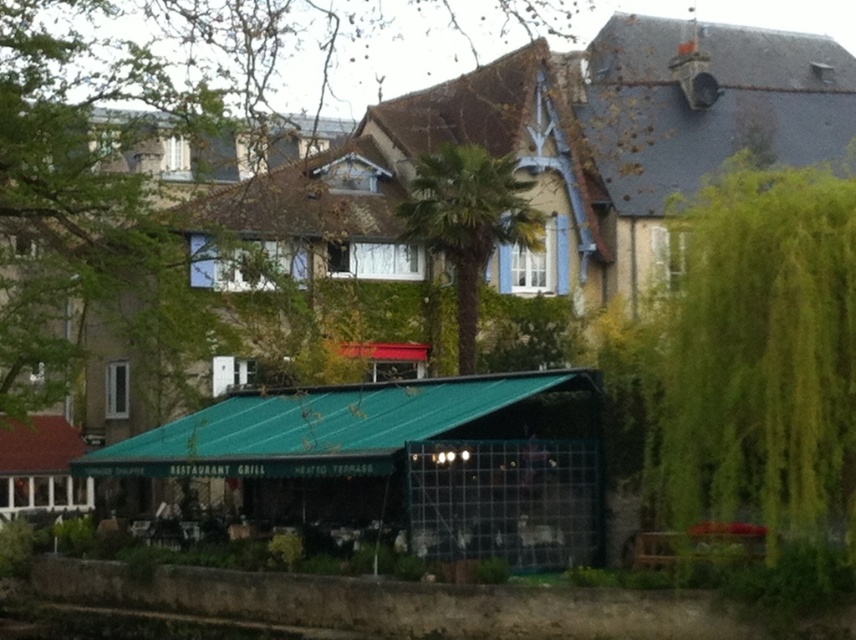
Based on the photo, you are a customer looking for a table under the green metal awning at center. You notice a green leafy tree at right nearby. Which object is wider from your perspective?

The green metal awning at center is wider than the green leafy tree at right.

You are a customer looking for shade while waiting for your table. You see the green leafy tree at right and the green metal awning at center. Which one provides more shade coverage?

The green leafy tree at right provides more shade coverage because it is bigger than the green metal awning at center.